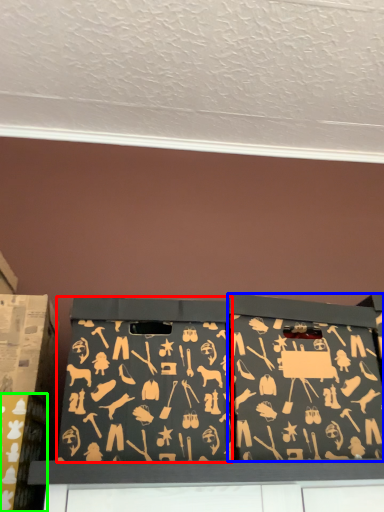
Question: Based on their relative distances, which object is farther from box (highlighted by a red box)? Choose from box (highlighted by a blue box) and box (highlighted by a green box).

Choices:
 (A) box
 (B) box

Answer: (B)